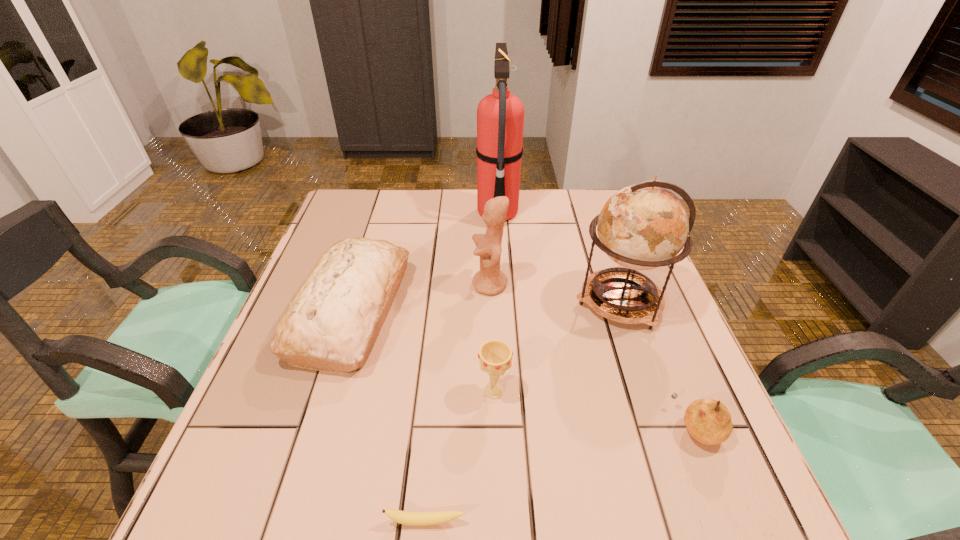
The image size is (960, 540). What are the coordinates of `the sixth closest object to the sixth object from right to left` in the screenshot? It's located at (500, 116).

Where is `object that is the second closest to the pear`? The width and height of the screenshot is (960, 540). object that is the second closest to the pear is located at coordinates (495, 356).

Locate an element on the screen. This screenshot has width=960, height=540. vacant space that satisfies the following two spatial constraints: 1. at the center of the globe; 2. on the upward curve of the banana is located at coordinates (695, 522).

Image resolution: width=960 pixels, height=540 pixels. In order to click on vacant region that satisfies the following two spatial constraints: 1. at the center of the globe; 2. on the right side of the pear in this screenshot , I will do `click(663, 428)`.

You are a GUI agent. You are given a task and a screenshot of the screen. Output one action in this format:
    pyautogui.click(x=<x>, y=<y>)
    Task: Click on the vacant space that satisfies the following two spatial constraints: 1. at the center of the pear; 2. on the left side of the second tallest object
    The width and height of the screenshot is (960, 540).
    Given the screenshot: What is the action you would take?
    pyautogui.click(x=663, y=428)

Identify the location of free space that satisfies the following two spatial constraints: 1. on the front-facing side of the figurine; 2. on the right side of the chalice. (492, 391).

Locate an element on the screen. This screenshot has width=960, height=540. free location that satisfies the following two spatial constraints: 1. on the front-facing side of the figurine; 2. on the right side of the pear is located at coordinates (493, 428).

In order to click on free location that satisfies the following two spatial constraints: 1. at the center of the globe; 2. on the upward curve of the second object from left to right in this screenshot , I will do tap(695, 522).